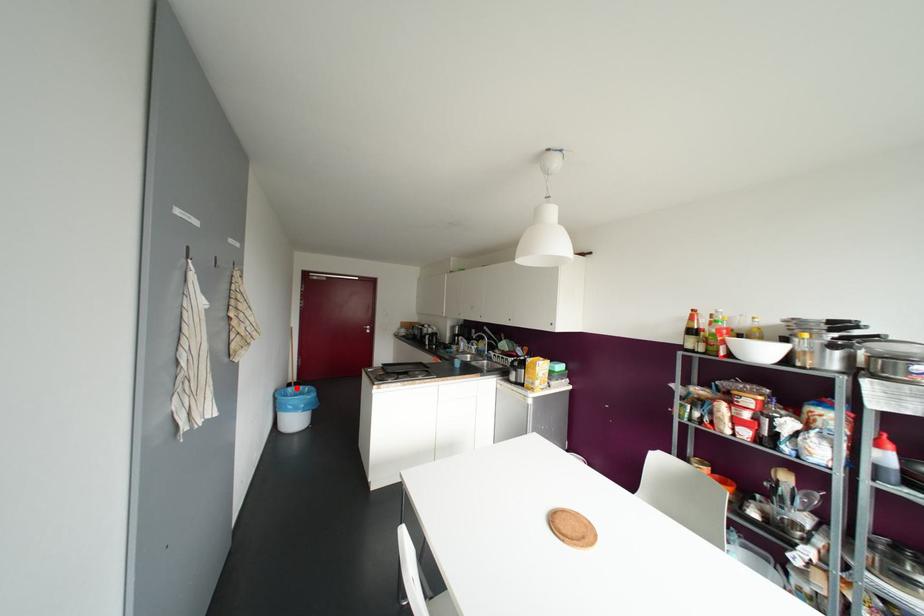
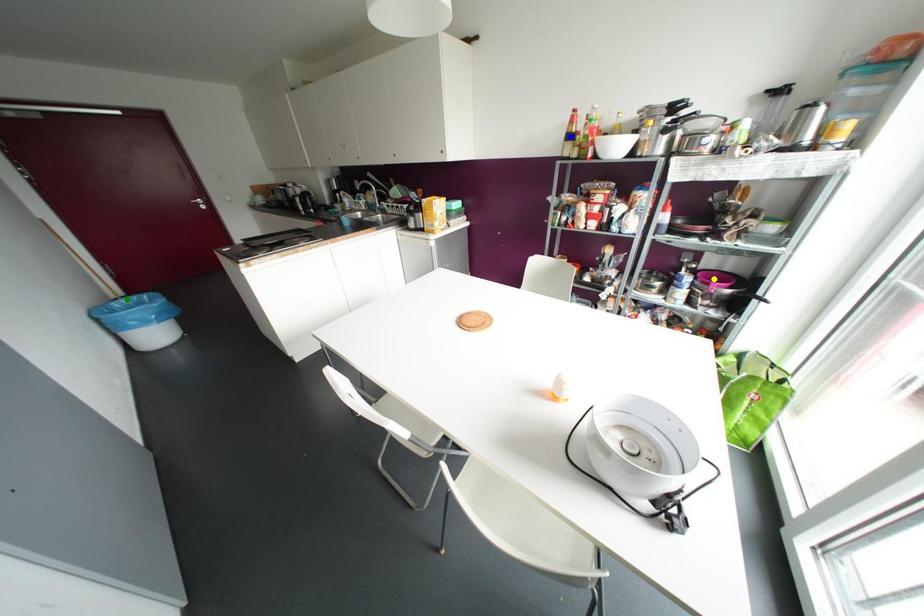
Question: I am providing you with two images of the same scene from different viewpoints. A red point is marked on the first image. You are given multiple points on the second image. Can you choose the point in image 2 that corresponds to the point in image 1?

Choices:
 (A) green point
 (B) blue point
 (C) yellow point

Answer: (A)